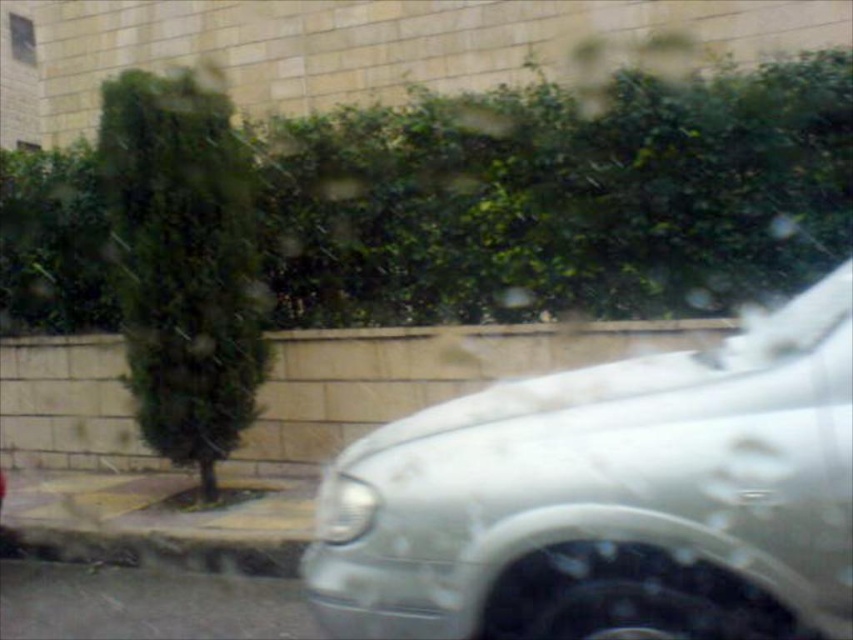
Is white glossy car at right taller than gray concrete curb at lower left?

Yes.

Between white glossy car at right and gray concrete curb at lower left, which one appears on the right side from the viewer's perspective?

Positioned to the right is white glossy car at right.

Is point (842, 536) closer to camera compared to point (16, 544)?

Yes, it is.

Locate an element on the screen. The height and width of the screenshot is (640, 853). white glossy car at right is located at coordinates (610, 499).